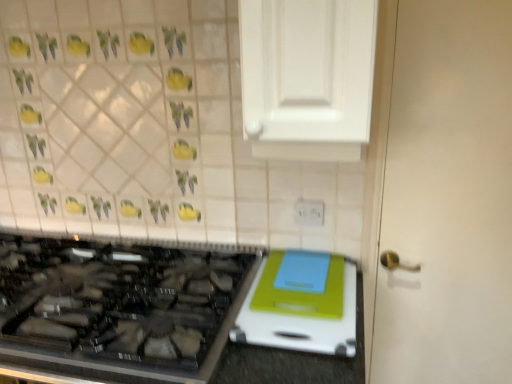
I want to click on white glossy cabinet at upper center, so click(307, 77).

The width and height of the screenshot is (512, 384). What do you see at coordinates (307, 77) in the screenshot?
I see `white glossy cabinet at upper center` at bounding box center [307, 77].

Image resolution: width=512 pixels, height=384 pixels. In order to click on white plastic cutting board at lower right in this screenshot , I will do `click(300, 324)`.

Identify the location of white matte door at right. (448, 197).

Where is `white glossy cabinet at upper center`? white glossy cabinet at upper center is located at coordinates (307, 77).

From the image's perspective, would you say white plastic cutting board at lower right is shown under white matte door at right?

Correct, white plastic cutting board at lower right appears lower than white matte door at right in the image.

Between white plastic cutting board at lower right and white matte door at right, which one has smaller width?

Thinner between the two is white matte door at right.

Between white plastic cutting board at lower right and white matte door at right, which one is positioned in front?

white plastic cutting board at lower right is more forward.

From a real-world perspective, is white plastic cutting board at lower right above or below white matte door at right?

white plastic cutting board at lower right is below white matte door at right.

In the scene shown: Can you tell me how much white matte door at right and white plastic cutting board at lower right differ in facing direction?

The angle between the facing direction of white matte door at right and the facing direction of white plastic cutting board at lower right is 0.371 degrees.

Considering the sizes of objects white matte door at right and white plastic cutting board at lower right in the image provided, who is bigger, white matte door at right or white plastic cutting board at lower right?

white matte door at right is bigger.

Is white matte door at right at the right side of white plastic cutting board at lower right?

Yes.

In the scene shown: From the image's perspective, does white matte door at right appear lower than white plastic cutting board at lower right?

No.

What's the angular difference between white glossy cabinet at upper center and white plastic cutting board at lower right's facing directions?

2.35 degrees separate the facing orientations of white glossy cabinet at upper center and white plastic cutting board at lower right.

Which object is positioned more to the left, white glossy cabinet at upper center or white plastic cutting board at lower right?

Positioned to the left is white plastic cutting board at lower right.

Is white glossy cabinet at upper center bigger than white plastic cutting board at lower right?

Yes.

How much distance is there between white glossy cabinet at upper center and white plastic cutting board at lower right?

They are 53.71 centimeters apart.

Does point (315, 217) come closer to viewer compared to point (358, 16)?

No, it is behind (358, 16).

Does white plastic electric outlet at upper center have a lesser width compared to white glossy cabinet at upper center?

Indeed, white plastic electric outlet at upper center has a lesser width compared to white glossy cabinet at upper center.

Who is taller, white plastic electric outlet at upper center or white glossy cabinet at upper center?

white glossy cabinet at upper center is taller.

Based on the photo, from the image's perspective, is white glossy cabinet at upper center above or below white matte door at right?

white glossy cabinet at upper center is situated higher than white matte door at right in the image.

Considering the relative sizes of white glossy cabinet at upper center and white matte door at right in the image provided, is white glossy cabinet at upper center wider than white matte door at right?

Yes.

At what (x,y) coordinates should I click in order to perform the action: click on cabinetry located above the white matte door at right (from the image's perspective). Please return your answer as a coordinate pair (x, y). Looking at the image, I should click on (307, 77).

Based on the photo, is white glossy cabinet at upper center aimed at white matte door at right?

No, white glossy cabinet at upper center is not facing towards white matte door at right.

Which point is more forward, (354, 329) or (298, 118)?

Positioned in front is point (298, 118).

Would you say white plastic cutting board at lower right is to the left or to the right of white glossy cabinet at upper center in the picture?

Based on their positions, white plastic cutting board at lower right is located to the left of white glossy cabinet at upper center.

Which object is thinner, white plastic cutting board at lower right or white glossy cabinet at upper center?

white glossy cabinet at upper center.

Is white plastic electric outlet at upper center touching white plastic cutting board at lower right?

white plastic electric outlet at upper center and white plastic cutting board at lower right are not in contact.

Is white plastic electric outlet at upper center in front of or behind white plastic cutting board at lower right in the image?

Visually, white plastic electric outlet at upper center is located behind white plastic cutting board at lower right.

From a real-world perspective, does white plastic electric outlet at upper center stand above white plastic cutting board at lower right?

Correct, in the physical world, white plastic electric outlet at upper center is higher than white plastic cutting board at lower right.

The image size is (512, 384). Find the location of `door that is on the right side of white plastic cutting board at lower right`. door that is on the right side of white plastic cutting board at lower right is located at coordinates (448, 197).

Image resolution: width=512 pixels, height=384 pixels. I want to click on appliance that appears on the left of white matte door at right, so click(300, 324).

Estimate the real-world distances between objects in this image. Which object is closer to white plastic electric outlet at upper center, black glass gas stove at lower left or white matte door at right?

Based on the image, white matte door at right appears to be nearer to white plastic electric outlet at upper center.

When comparing their distances from white plastic electric outlet at upper center, does white matte door at right or white glossy cabinet at upper center seem further?

white glossy cabinet at upper center is further to white plastic electric outlet at upper center.

Estimate the real-world distances between objects in this image. Which object is further from white matte door at right, white glossy cabinet at upper center or white plastic cutting board at lower right?

white plastic cutting board at lower right is positioned further to the anchor white matte door at right.

Looking at the image, which one is located further to black glass gas stove at lower left, white matte door at right or white plastic cutting board at lower right?

white matte door at right is further to black glass gas stove at lower left.

From the picture: Looking at the image, which one is located closer to white plastic cutting board at lower right, black glass gas stove at lower left or white matte door at right?

The object closer to white plastic cutting board at lower right is black glass gas stove at lower left.

When comparing their distances from white matte door at right, does white plastic electric outlet at upper center or white glossy cabinet at upper center seem further?

white plastic electric outlet at upper center.

From the image, which object appears to be nearer to black glass gas stove at lower left, white plastic electric outlet at upper center or white plastic cutting board at lower right?

white plastic cutting board at lower right is positioned closer to the anchor black glass gas stove at lower left.

Based on their spatial positions, is white matte door at right or white glossy cabinet at upper center further from white plastic cutting board at lower right?

white glossy cabinet at upper center is positioned further to the anchor white plastic cutting board at lower right.

Locate an element on the screen. The image size is (512, 384). appliance situated between black glass gas stove at lower left and white glossy cabinet at upper center from left to right is located at coordinates (300, 324).

Find the location of `cabinetry situated between black glass gas stove at lower left and white plastic electric outlet at upper center from left to right`. cabinetry situated between black glass gas stove at lower left and white plastic electric outlet at upper center from left to right is located at coordinates click(x=307, y=77).

Identify the location of door between white glossy cabinet at upper center and white plastic cutting board at lower right vertically. This screenshot has width=512, height=384. (448, 197).

Where is `door between white glossy cabinet at upper center and white plastic electric outlet at upper center in the front-back direction`? This screenshot has width=512, height=384. door between white glossy cabinet at upper center and white plastic electric outlet at upper center in the front-back direction is located at coordinates (x=448, y=197).